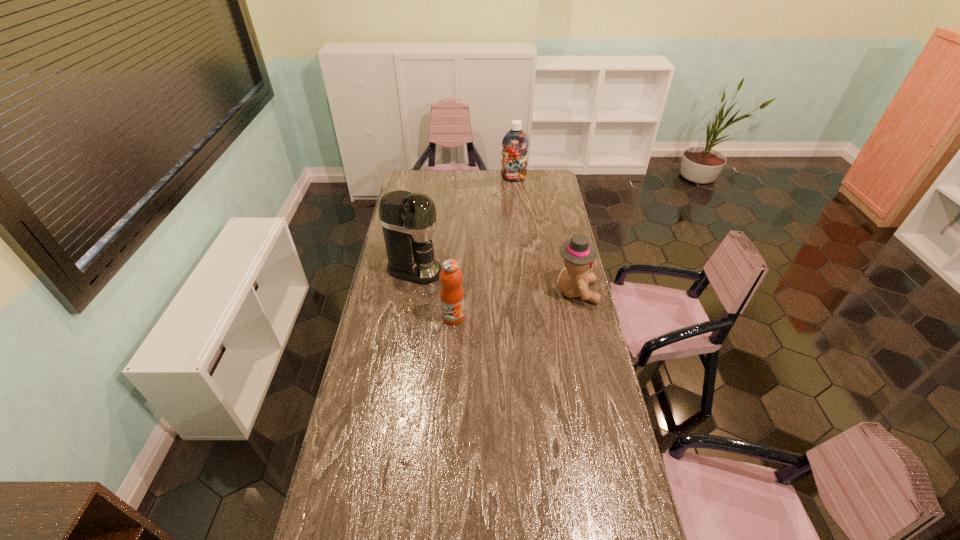
What are the coordinates of `free space between the second object from left to right and the rag_doll` in the screenshot? It's located at (515, 305).

At what (x,y) coordinates should I click in order to perform the action: click on vacant area that lies between the shampoo and the coffee maker. Please return your answer as a coordinate pair (x, y). The height and width of the screenshot is (540, 960). Looking at the image, I should click on (464, 224).

This screenshot has width=960, height=540. I want to click on free space between the fruit juice and the rag_doll, so click(515, 305).

Find the location of a particular element. The height and width of the screenshot is (540, 960). empty location between the rightmost object and the shampoo is located at coordinates (544, 235).

Where is `free point between the rag_doll and the fruit juice`? free point between the rag_doll and the fruit juice is located at coordinates (515, 305).

Find the location of a particular element. This screenshot has height=540, width=960. free space between the third object from right to left and the rag_doll is located at coordinates (515, 305).

Where is `free space between the fruit juice and the coffee maker`? Image resolution: width=960 pixels, height=540 pixels. free space between the fruit juice and the coffee maker is located at coordinates [x=434, y=294].

The image size is (960, 540). I want to click on unoccupied position between the rag_doll and the coffee maker, so click(495, 281).

Identify the location of unoccupied area between the second tallest object and the coffee maker. (464, 224).

I want to click on the closest object relative to the third shortest object, so click(408, 220).